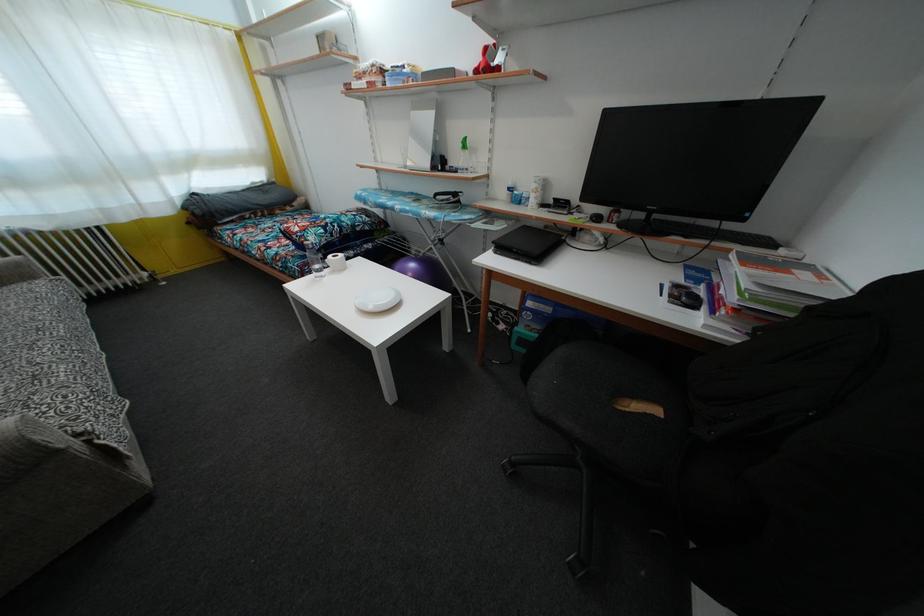
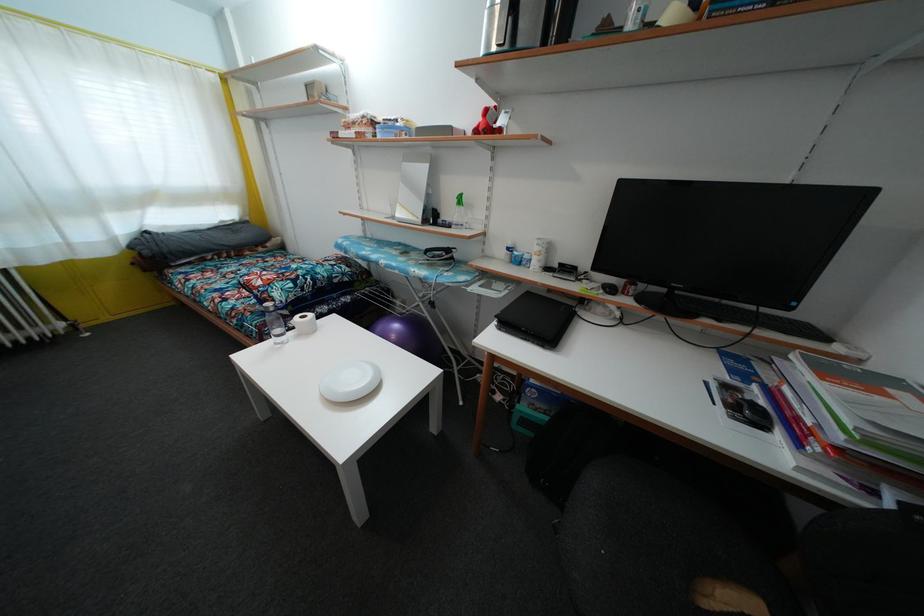
Where in the second image is the point corresponding to pixel 314 253 from the first image?

(275, 315)